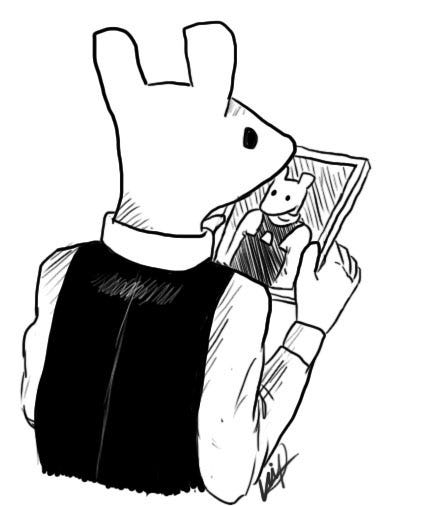
This screenshot has width=430, height=506. I want to click on picture frame, so click(282, 293), click(335, 220), click(330, 156), click(227, 210), click(218, 234).